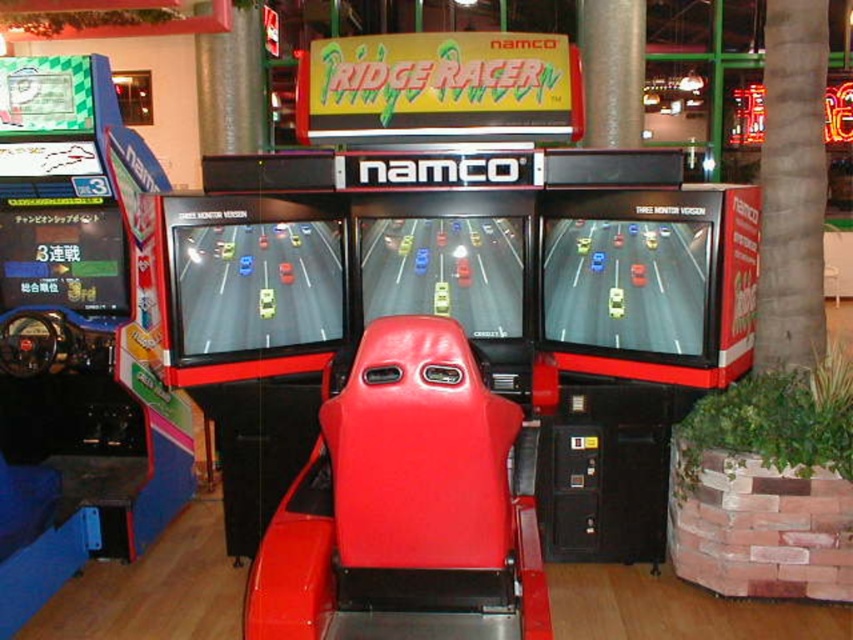
Is point (701, 330) closer to camera compared to point (366, 225)?

Yes, it is in front of point (366, 225).

Does shiny plastic screen at center have a greater height compared to shiny plastic car seat at center?

Yes.

Where is `shiny plastic screen at center`? The width and height of the screenshot is (853, 640). shiny plastic screen at center is located at coordinates (625, 284).

Where is `shiny plastic screen at center`? The width and height of the screenshot is (853, 640). shiny plastic screen at center is located at coordinates (625, 284).

Can you confirm if gray textured pillar at center right is positioned above shiny plastic arcade machine at center?

Yes.

Does gray textured pillar at center right have a smaller size compared to shiny plastic arcade machine at center?

Incorrect, gray textured pillar at center right is not smaller in size than shiny plastic arcade machine at center.

Is point (819, 241) in front of point (206, 355)?

That is False.

Locate an element on the screen. gray textured pillar at center right is located at coordinates (792, 188).

Does gray textured pillar at center right appear under shiny plastic screen at center?

No, gray textured pillar at center right is not below shiny plastic screen at center.

Which is behind, point (792, 358) or point (698, 221)?

The point (792, 358) is more distant.

Where is `gray textured pillar at center right`? This screenshot has width=853, height=640. gray textured pillar at center right is located at coordinates (792, 188).